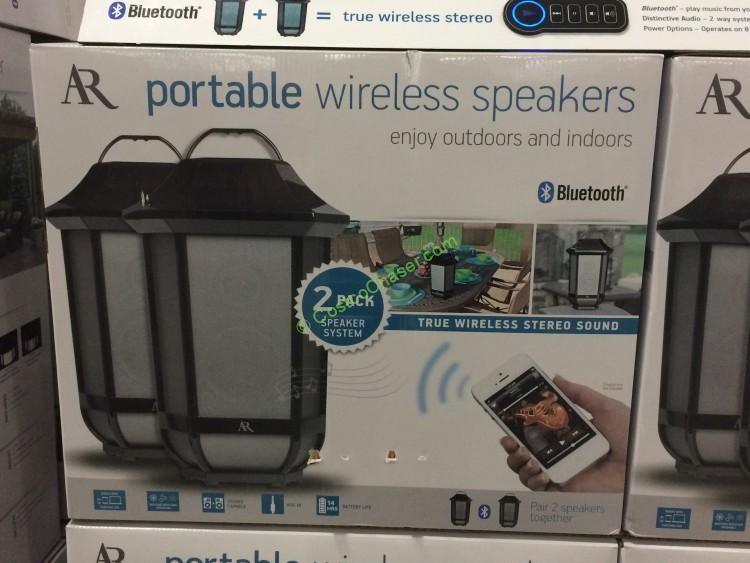
Locate an element on the screen. This screenshot has height=563, width=750. cardboard box is located at coordinates (364, 176), (10, 294), (687, 128).